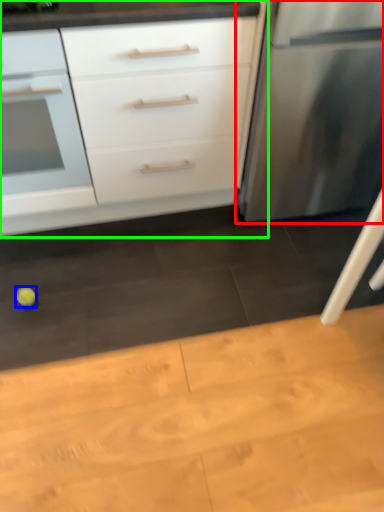
Question: Based on their relative distances, which object is nearer to refrigerator (highlighted by a red box)? Choose from lime (highlighted by a blue box) and chest of drawers (highlighted by a green box).

Choices:
 (A) lime
 (B) chest of drawers

Answer: (B)